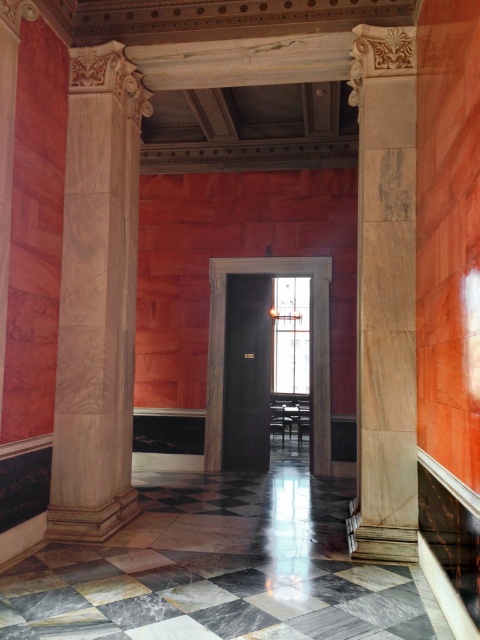
Question: Does white marble column at right have a smaller size compared to dark wood door at center?

Choices:
 (A) no
 (B) yes

Answer: (B)

Question: Which of these objects is positioned closest to the white marble column at right?

Choices:
 (A) dark wood door at center
 (B) marble column at center

Answer: (B)

Question: Which object is closer to the camera taking this photo?

Choices:
 (A) dark wood door at center
 (B) marble column at center

Answer: (B)

Question: Is marble column at center to the left of dark wood door at center from the viewer's perspective?

Choices:
 (A) yes
 (B) no

Answer: (A)

Question: Which point is closer to the camera?

Choices:
 (A) dark wood door at center
 (B) marble column at center

Answer: (B)

Question: Does white marble column at right have a greater width compared to dark wood door at center?

Choices:
 (A) yes
 (B) no

Answer: (B)